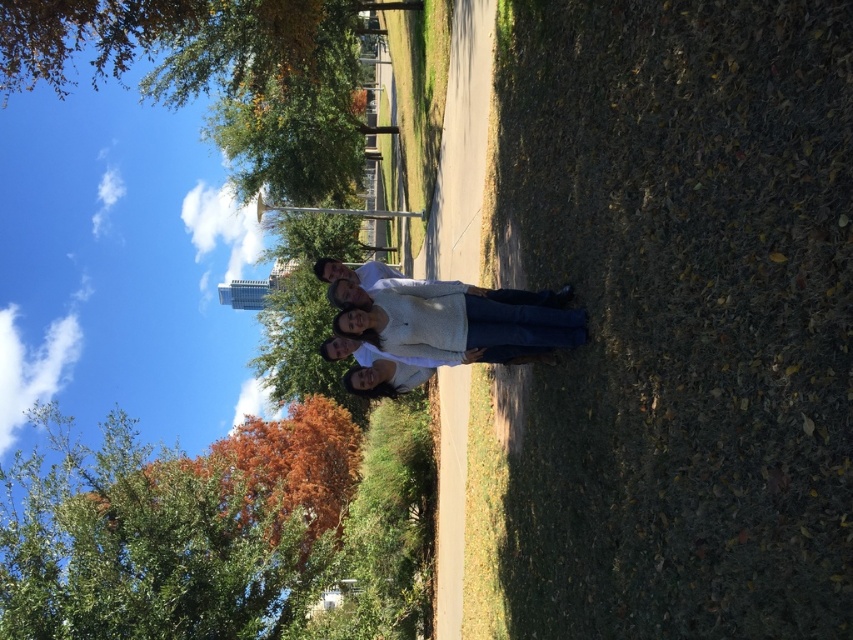
In the scene shown: Does green leafy tree at center have a larger size compared to white matte sweater at center?

Yes.

Which is behind, point (194, 525) or point (402, 291)?

The point (194, 525) is more distant.

Between point (77, 496) and point (422, 342), which one is positioned behind?

The point (77, 496) is more distant.

Where is `green leafy tree at center`? The height and width of the screenshot is (640, 853). green leafy tree at center is located at coordinates (187, 534).

Can you confirm if green leafy tree at center is thinner than white matte jacket at center?

Incorrect, green leafy tree at center's width is not less than white matte jacket at center's.

Who is more distant from viewer, (177,548) or (358,294)?

Point (177,548)

This screenshot has height=640, width=853. What are the coordinates of `green leafy tree at center` in the screenshot? It's located at (187, 534).

At what (x,y) coordinates should I click in order to perform the action: click on white matte sweater at center. Please return your answer as a coordinate pair (x, y). Looking at the image, I should click on (456, 323).

Image resolution: width=853 pixels, height=640 pixels. Describe the element at coordinates (456, 323) in the screenshot. I see `white matte sweater at center` at that location.

Does point (393, 312) come closer to viewer compared to point (550, 301)?

That is True.

I want to click on white matte sweater at center, so click(456, 323).